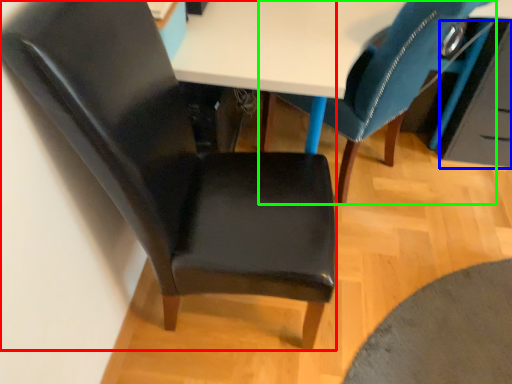
Question: Based on their relative distances, which object is nearer to chair (highlighted by a red box)? Choose from drawer (highlighted by a blue box) and chair (highlighted by a green box).

Choices:
 (A) drawer
 (B) chair

Answer: (B)